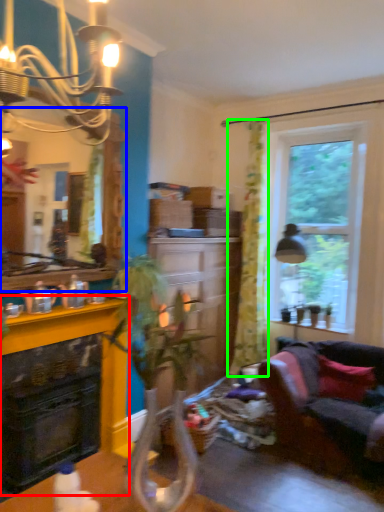
Question: Based on their relative distances, which object is nearer to fireplace (highlighted by a red box)? Choose from mirror (highlighted by a blue box) and curtain (highlighted by a green box).

Choices:
 (A) mirror
 (B) curtain

Answer: (A)